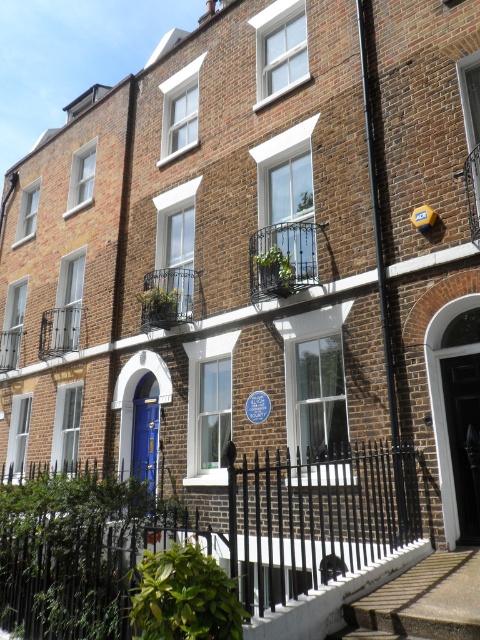
You are standing in front of the row of traditional brick townhouses. You notice two points marked on the image. The first point is at coordinates point (69, 586) and the second point is at point (471, 419). Which of these two points is closer to your viewpoint?

Point (69, 586) is closer to the camera than point (471, 419).

You are standing in front of the row of traditional brick townhouses and want to take a photo. You notice two points marked in the image. Which point, point (404, 483) or point (151, 426), is closer to your current position?

Point (404, 483) is closer to the camera than point (151, 426), so it is closer to your current position.